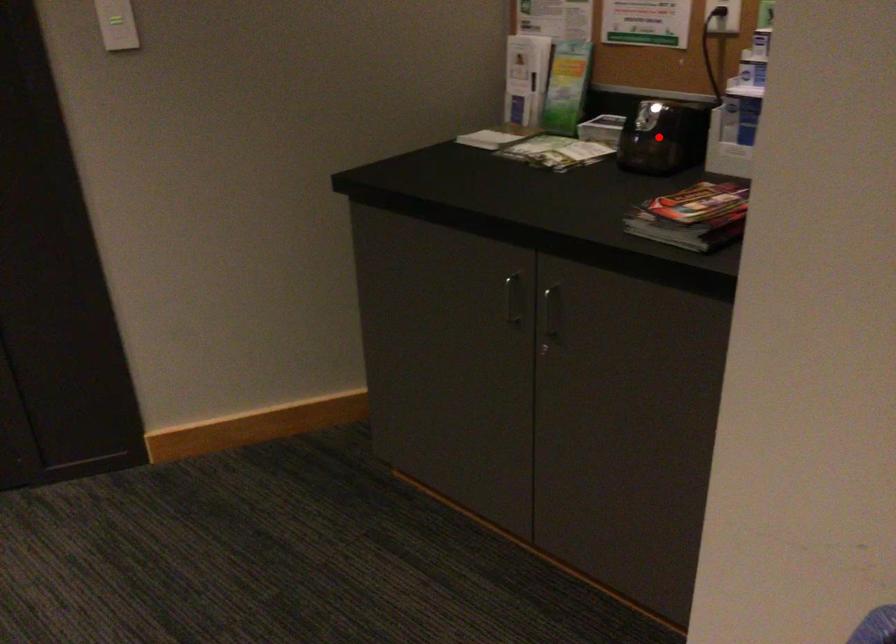
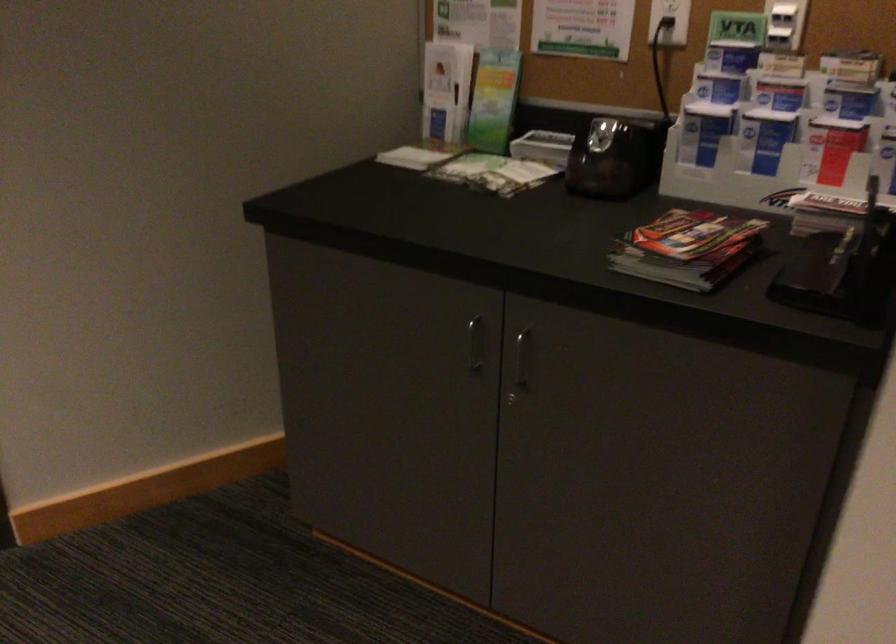
Where in the second image is the point corresponding to the highlighted location from the first image?

(613, 158)